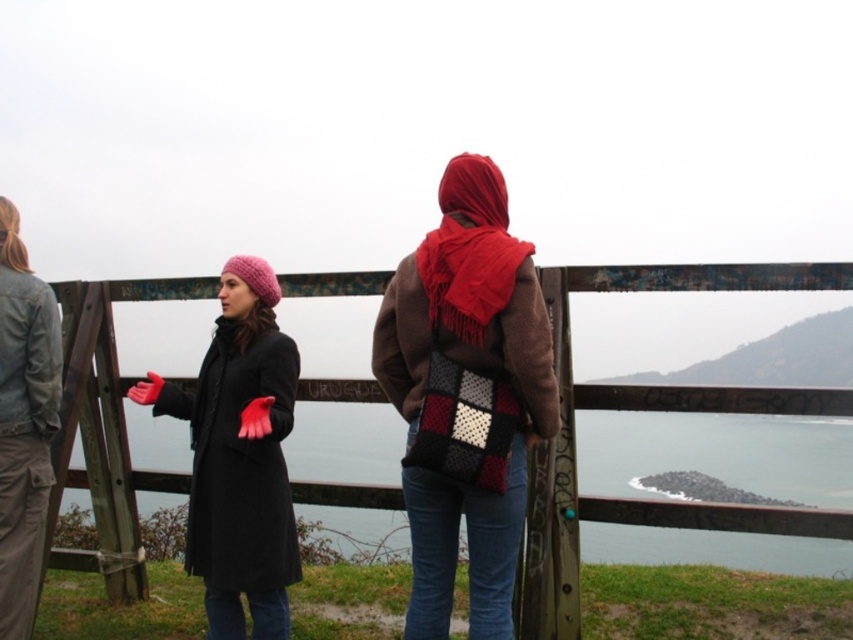
Looking at this image, you are a photographer trying to capture a photo of the wooden at center and the red woolen scarf at center. Which object should you focus on first if you want to ensure both are in the frame without moving the camera?

The wooden at center is larger than the red woolen scarf at center, so you should focus on the wooden at center first to ensure it fits within the frame before adjusting for the smaller red woolen scarf at center.

You are a photographer trying to capture a photo of the wooden at center and knitted wool scarf at center. Which object should you zoom in on to ensure both are clearly visible in the frame?

The wooden at center is smaller than the knitted wool scarf at center, so you should zoom in on the wooden at center to ensure both are clearly visible in the frame.